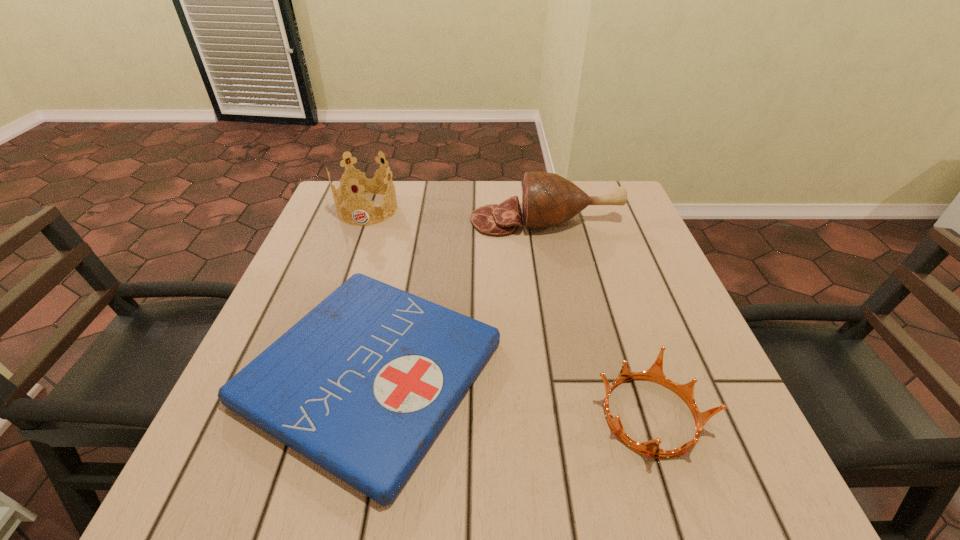
Identify the location of the left crown. (361, 180).

Locate an element on the screen. the taller crown is located at coordinates (361, 180).

Where is `ham`? ham is located at coordinates (548, 199).

Identify the location of the right crown. (651, 448).

This screenshot has width=960, height=540. In order to click on the nearer crown in this screenshot , I will do `click(651, 448)`.

Locate an element on the screen. Image resolution: width=960 pixels, height=540 pixels. the shortest object is located at coordinates (362, 385).

Where is `free spot located 0.070m on the back of the taller crown`? The height and width of the screenshot is (540, 960). free spot located 0.070m on the back of the taller crown is located at coordinates (377, 182).

This screenshot has height=540, width=960. I want to click on vacant space positioned 0.130m at the sliced end of the ham, so click(420, 221).

Find the location of a particular element. vacant space located 0.260m at the sliced end of the ham is located at coordinates (371, 221).

Where is `vacant space located at the sliced end of the ham`? Image resolution: width=960 pixels, height=540 pixels. vacant space located at the sliced end of the ham is located at coordinates (409, 221).